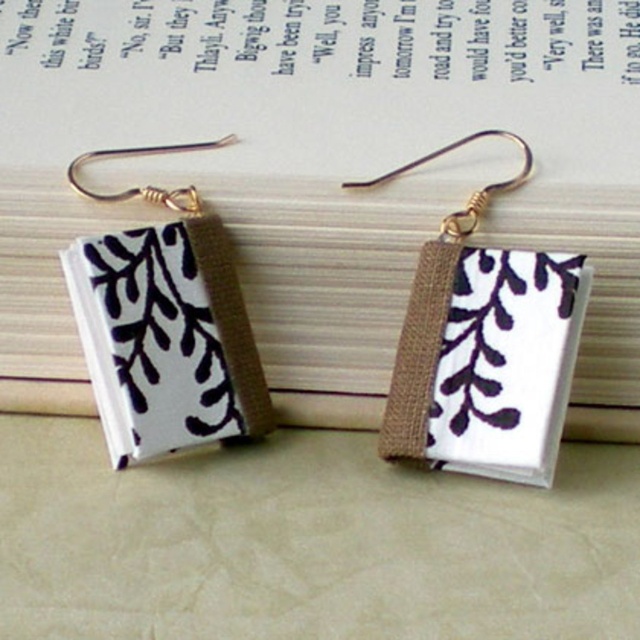
Does white fabric book at center have a lesser height compared to white fabric book at left?

No.

Does white fabric book at center appear on the left side of white fabric book at left?

Incorrect, white fabric book at center is not on the left side of white fabric book at left.

Which is in front, point (628, 429) or point (189, 404)?

Point (189, 404) is in front.

I want to click on white fabric book at center, so click(323, 170).